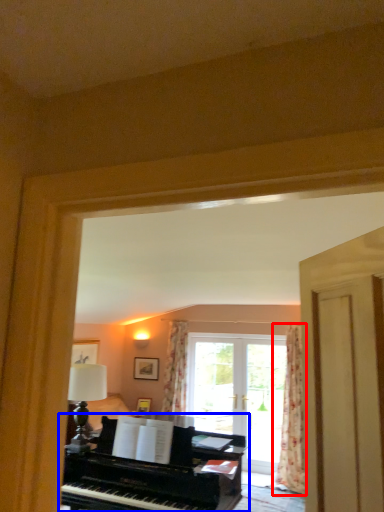
Question: Among these objects, which one is nearest to the camera, curtain (highlighted by a red box) or piano (highlighted by a blue box)?

Choices:
 (A) curtain
 (B) piano

Answer: (B)